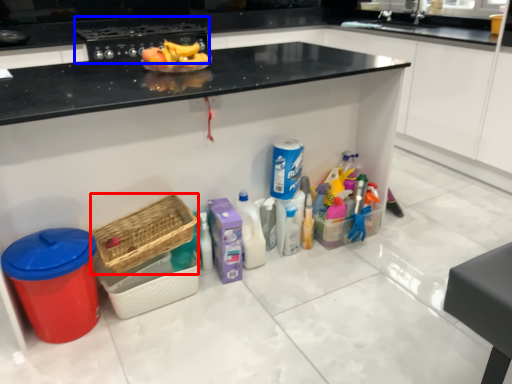
Question: Which point is closer to the camera, basket (highlighted by a red box) or appliance (highlighted by a blue box)?

Choices:
 (A) basket
 (B) appliance

Answer: (A)